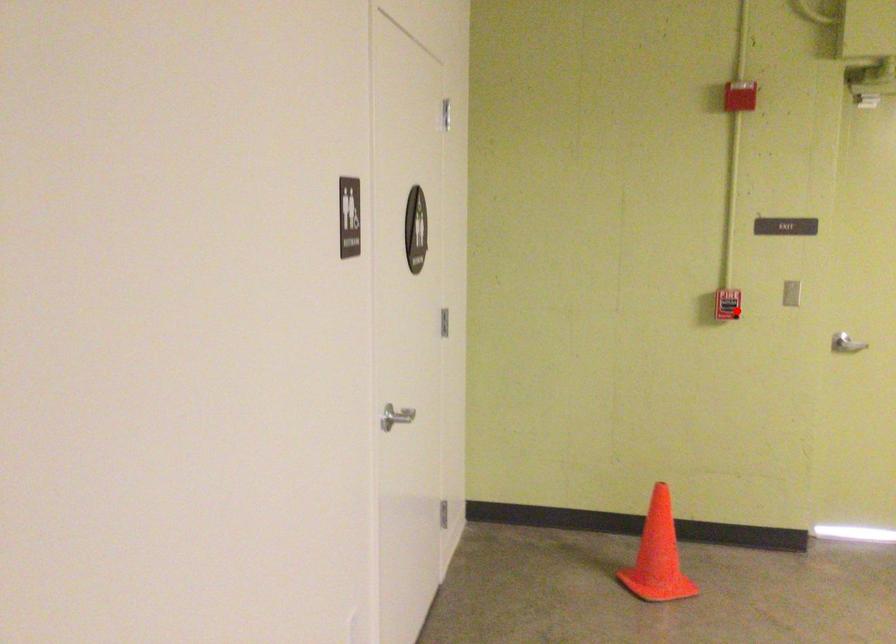
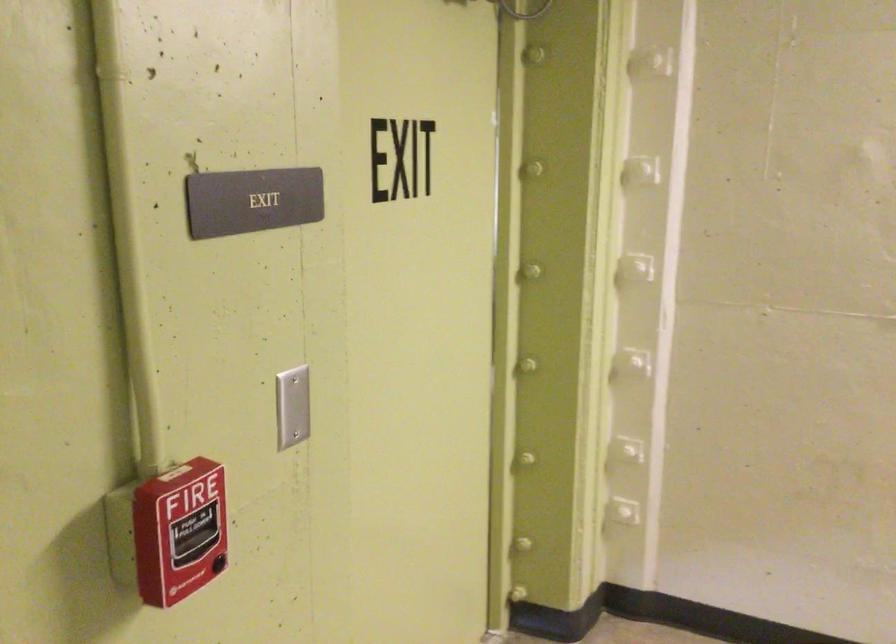
Locate, in the second image, the point that corresponds to the highlighted location in the first image.

(179, 532)